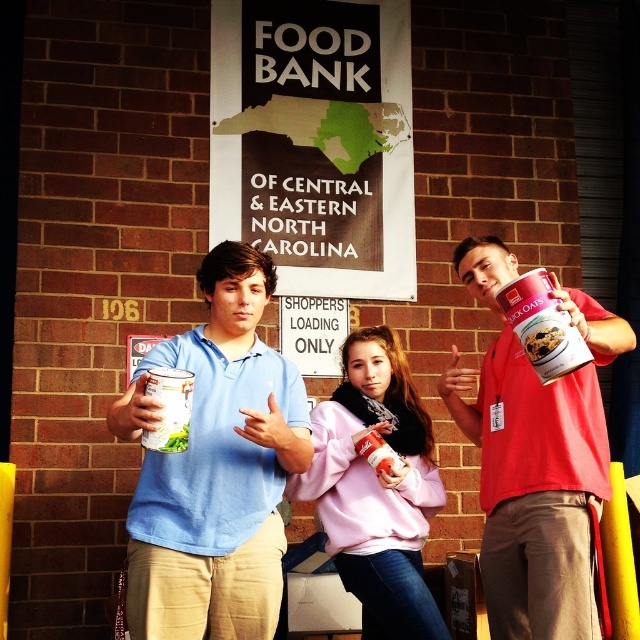
You are standing at point (321, 26) and want to walk to point (381, 428). Is there a clear path between these two points?

Yes, there is a clear path between point (321, 26) and point (381, 428) because the individuals are standing in front of a brick wall and there are no obstructions mentioned between them.

Where is the matte black sign at center located in the image?

The matte black sign at center is located at point (x=316, y=141).

You are a volunteer at the food bank and need to place a new donation box between the matte black sign at center and the matte red can at center. The box requires 3 meters of space. Is there enough space between them to place the box?

The distance between the matte black sign at center and the matte red can at center is 4.52 meters. Since the donation box requires 3 meters of space, there is enough space to place the box between them.